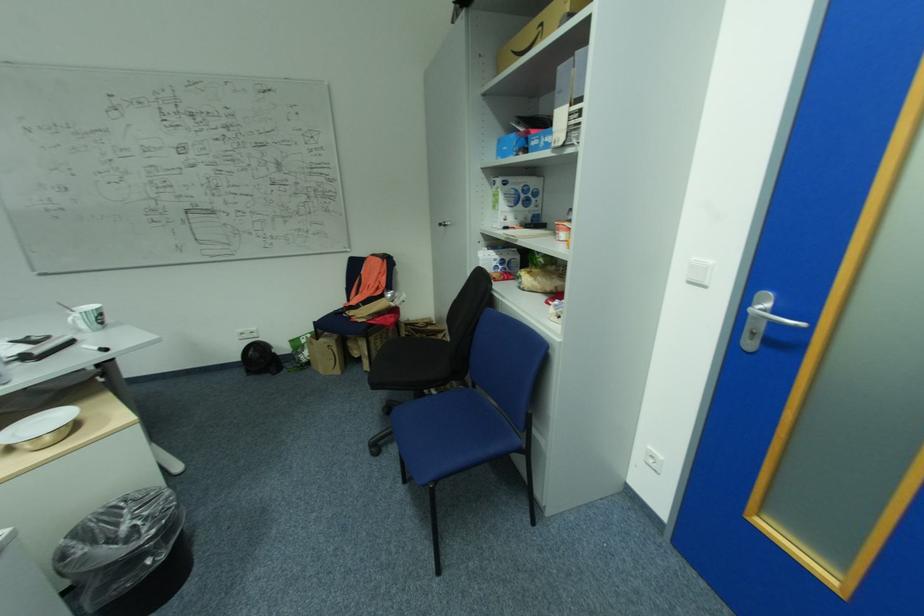
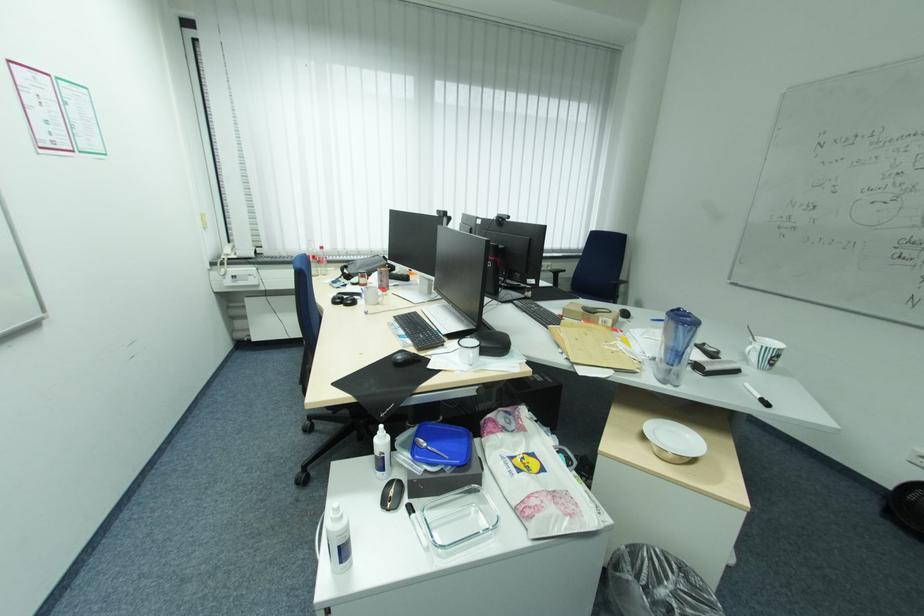
The point at (30, 128) is marked in the first image. Where is the corresponding point in the second image?

(827, 144)